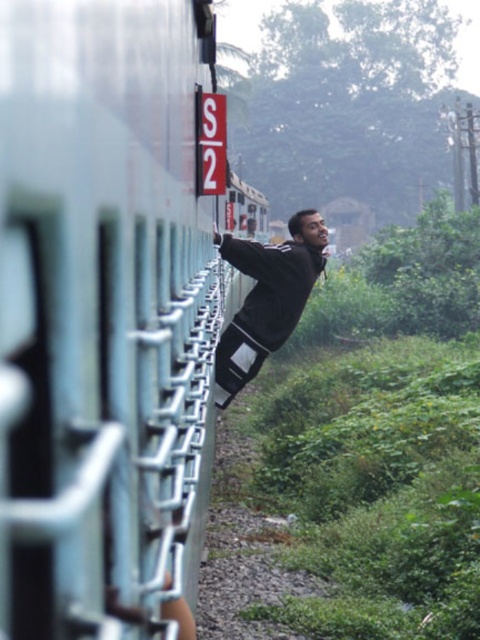
Question: Considering the relative positions of metallic silver train at center and dark gray jacket at center in the image provided, where is metallic silver train at center located with respect to dark gray jacket at center?

Choices:
 (A) right
 (B) left

Answer: (A)

Question: Considering the relative positions of metallic silver train at center and dark gray jacket at center in the image provided, where is metallic silver train at center located with respect to dark gray jacket at center?

Choices:
 (A) right
 (B) left

Answer: (A)

Question: Which object is farther from the camera taking this photo?

Choices:
 (A) dark gray jacket at center
 (B) metallic silver train at center

Answer: (A)

Question: Which object is closer to the camera taking this photo?

Choices:
 (A) dark gray jacket at center
 (B) metallic silver train at center

Answer: (B)

Question: Which of the following is the farthest from the observer?

Choices:
 (A) dark gray jacket at center
 (B) metallic silver train at center

Answer: (A)

Question: Can you confirm if metallic silver train at center is wider than dark gray jacket at center?

Choices:
 (A) no
 (B) yes

Answer: (A)